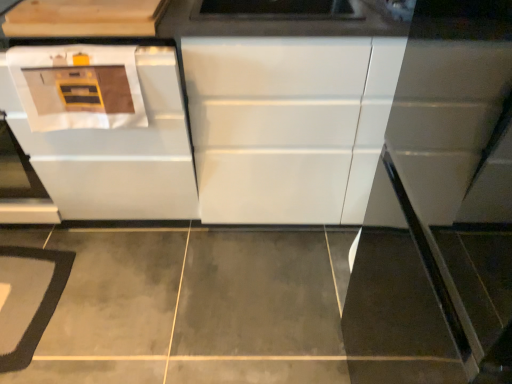
Question: From a real-world perspective, is white glossy oven at left positioned above or below white glossy cabinet at center, the first cabinetry positioned from the right?

Choices:
 (A) above
 (B) below

Answer: (B)

Question: Visually, is white glossy oven at left positioned to the left or to the right of white glossy cabinet at center, the first cabinetry positioned from the right?

Choices:
 (A) right
 (B) left

Answer: (B)

Question: Which object is positioned farthest from the gray carpet at lower left?

Choices:
 (A) light wood cabinet at upper left, arranged as the 2th cabinetry when viewed from the right
 (B) white glossy oven at left
 (C) white glossy cabinet at center, the first cabinetry positioned from the right

Answer: (A)

Question: Which is farther from the light wood cabinet at upper left, the first cabinetry from the left?

Choices:
 (A) gray carpet at lower left
 (B) white glossy cabinet at center, which is counted as the 2th cabinetry, starting from the left
 (C) white glossy oven at left

Answer: (A)